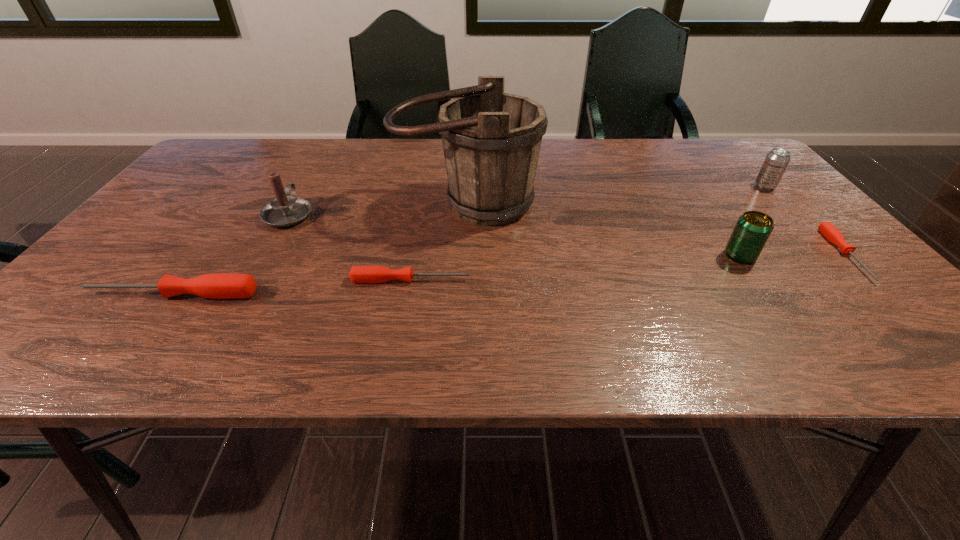
Find the location of `object present at the left edge`. object present at the left edge is located at coordinates (218, 286).

Image resolution: width=960 pixels, height=540 pixels. In order to click on screwdriver that is at the right edge in this screenshot , I will do `click(830, 232)`.

Find the location of a particular element. The width and height of the screenshot is (960, 540). beer can positioned at the right edge is located at coordinates (777, 160).

What are the coordinates of `object located in the near left corner section of the desktop` in the screenshot? It's located at [218, 286].

The image size is (960, 540). In order to click on vacant space at the far edge of the desktop in this screenshot , I will do `click(434, 165)`.

Find the location of a particular element. This screenshot has width=960, height=540. vacant space at the near edge of the desktop is located at coordinates (657, 308).

Find the location of a particular element. free space at the left edge of the desktop is located at coordinates (173, 250).

The image size is (960, 540). In order to click on free region at the right edge in this screenshot , I will do `click(805, 279)`.

Image resolution: width=960 pixels, height=540 pixels. In order to click on vacant point at the far left corner in this screenshot , I will do [x=253, y=141].

This screenshot has height=540, width=960. In order to click on free area in between the second screwdriver from right to left and the nearer beer can in this screenshot , I will do `click(575, 268)`.